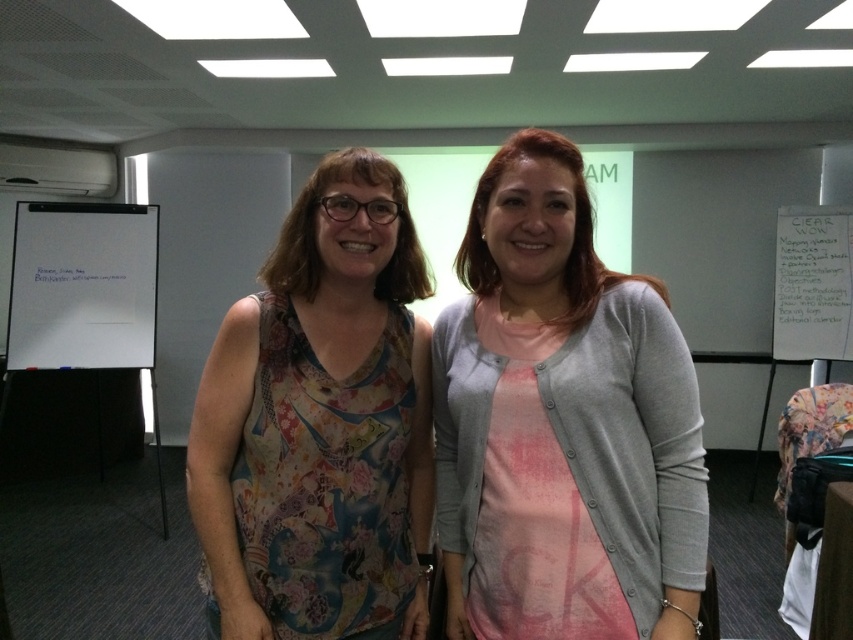
Question: Is pink fabric shirt at center smaller than floral-patterned tank top at center?

Choices:
 (A) no
 (B) yes

Answer: (B)

Question: Estimate the real-world distances between objects in this image. Which object is closer to the white paper at right?

Choices:
 (A) pink fabric shirt at center
 (B) whiteboard at left

Answer: (A)

Question: Can you confirm if pink fabric shirt at center is positioned above white paper at right?

Choices:
 (A) no
 (B) yes

Answer: (A)

Question: In this image, where is pink fabric shirt at center located relative to floral-patterned tank top at center?

Choices:
 (A) above
 (B) below

Answer: (A)

Question: Which point is farther to the camera?

Choices:
 (A) whiteboard at left
 (B) floral-patterned tank top at center
 (C) white paper at right

Answer: (C)

Question: Which of the following is the farthest from the observer?

Choices:
 (A) whiteboard at left
 (B) pink fabric shirt at center
 (C) white paper at right
 (D) floral-patterned tank top at center

Answer: (C)